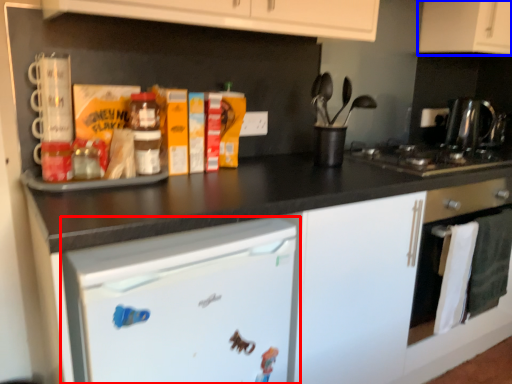
Question: Among these objects, which one is farthest to the camera, home appliance (highlighted by a red box) or cabinetry (highlighted by a blue box)?

Choices:
 (A) home appliance
 (B) cabinetry

Answer: (B)